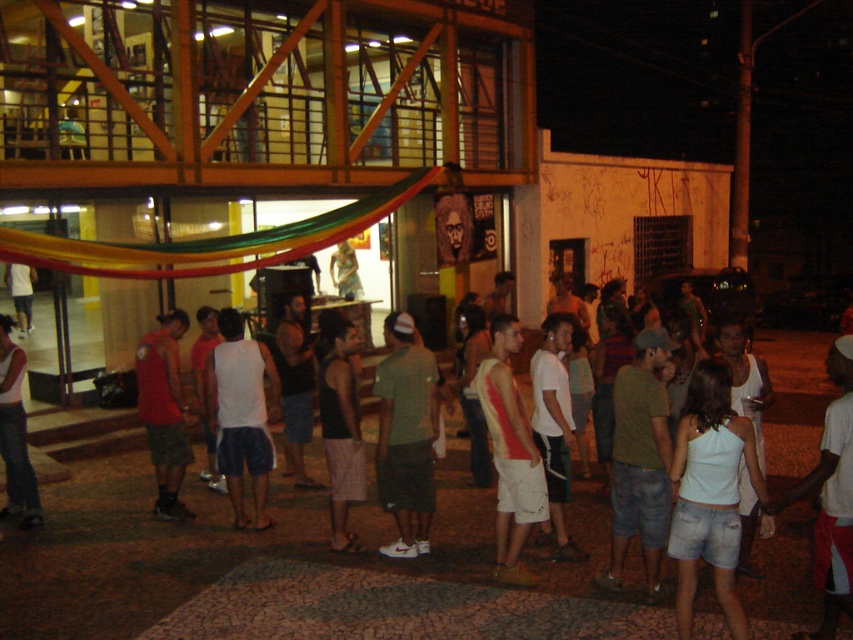
Who is shorter, green cotton shirt at center or white tank top at lower left?

white tank top at lower left is shorter.

Does green cotton shirt at center appear on the left side of white tank top at lower left?

No, green cotton shirt at center is not to the left of white tank top at lower left.

Which is in front, point (396, 552) or point (19, 365)?

Point (396, 552) is in front.

You are a GUI agent. You are given a task and a screenshot of the screen. Output one action in this format:
    pyautogui.click(x=<x>, y=<y>)
    Task: Click on the green cotton shirt at center
    The image size is (853, 640).
    Given the screenshot: What is the action you would take?
    pyautogui.click(x=405, y=435)

Does point (669, 547) come behind point (321, 364)?

No, (669, 547) is closer to viewer.

Between white cotton tank top at center and black fabric tank top at center, which one appears on the left side from the viewer's perspective?

black fabric tank top at center is more to the left.

In order to click on white cotton tank top at center in this screenshot , I will do `click(709, 492)`.

Who is higher up, white matte tank top at center or black fabric tank top at center?

white matte tank top at center is above.

Which is in front, point (265, 355) or point (340, 410)?

Point (340, 410)

Does point (242, 362) lie behind point (329, 492)?

Yes.

Where is `white matte tank top at center`? This screenshot has height=640, width=853. white matte tank top at center is located at coordinates (241, 413).